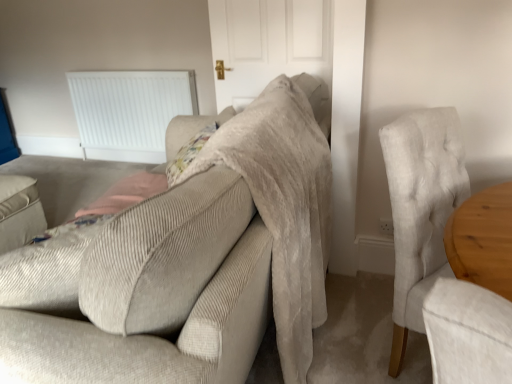
Locate an element on the screen. This screenshot has width=512, height=384. white plastic radiator at upper left is located at coordinates (130, 110).

This screenshot has width=512, height=384. What are the coordinates of `white plastic radiator at upper left` in the screenshot? It's located at (130, 110).

Considering the positions of objects light gray fabric chair at right and white matte door at center in the image provided, who is more to the left, light gray fabric chair at right or white matte door at center?

white matte door at center.

Who is taller, light gray fabric chair at right or white matte door at center?

light gray fabric chair at right.

How different are the orientations of light gray fabric chair at right and white matte door at center in degrees?

The facing directions of light gray fabric chair at right and white matte door at center are 118 degrees apart.

Is light gray fabric chair at right turned away from white matte door at center?

Yes, light gray fabric chair at right's orientation is away from white matte door at center.

Where is `door on the right of beige corduroy couch at center`? This screenshot has width=512, height=384. door on the right of beige corduroy couch at center is located at coordinates (268, 44).

Can you confirm if beige corduroy couch at center is shorter than white matte door at center?

No, beige corduroy couch at center is not shorter than white matte door at center.

Is point (53, 346) farther from viewer compared to point (255, 94)?

No, (53, 346) is closer to viewer.

Does beige corduroy couch at center appear on the left side of white matte door at center?

Correct, you'll find beige corduroy couch at center to the left of white matte door at center.

Is white plastic radiator at upper left closer to camera compared to white matte door at center?

No, white plastic radiator at upper left is further to the viewer.

Can you confirm if white plastic radiator at upper left is thinner than white matte door at center?

No.

Consider the image. Is white plastic radiator at upper left facing away from white matte door at center?

No, white plastic radiator at upper left's orientation is not away from white matte door at center.

Is there a large distance between white plastic radiator at upper left and white matte door at center?

Yes, white plastic radiator at upper left is far from white matte door at center.

Is white matte door at center situated inside light gray fabric chair at right or outside?

white matte door at center is outside light gray fabric chair at right.

Is white matte door at center shorter than light gray fabric chair at right?

Indeed, white matte door at center has a lesser height compared to light gray fabric chair at right.

Is white matte door at center oriented towards light gray fabric chair at right?

No, white matte door at center is not aimed at light gray fabric chair at right.

Are white plastic radiator at upper left and beige corduroy couch at center beside each other?

No, white plastic radiator at upper left is not with beige corduroy couch at center.

Which object is thinner, white plastic radiator at upper left or beige corduroy couch at center?

Thinner between the two is white plastic radiator at upper left.

Looking at the image, does white plastic radiator at upper left seem bigger or smaller compared to beige corduroy couch at center?

In the image, white plastic radiator at upper left appears to be smaller than beige corduroy couch at center.

Is white plastic radiator at upper left not inside beige corduroy couch at center?

Absolutely, white plastic radiator at upper left is external to beige corduroy couch at center.

Is light gray fabric chair at right a part of beige corduroy couch at center?

No, beige corduroy couch at center does not contain light gray fabric chair at right.

Does point (301, 226) come in front of point (402, 310)?

That is True.

Does beige corduroy couch at center have a smaller size compared to light gray fabric chair at right?

Actually, beige corduroy couch at center might be larger than light gray fabric chair at right.

At what (x,y) coordinates should I click in order to perform the action: click on radiator below the light gray fabric chair at right (from a real-world perspective). Please return your answer as a coordinate pair (x, y). Looking at the image, I should click on (130, 110).

Can you tell me how much white plastic radiator at upper left and light gray fabric chair at right differ in facing direction?

The facing directions of white plastic radiator at upper left and light gray fabric chair at right are 59.4 degrees apart.

Is point (164, 129) less distant than point (397, 174)?

No.

In terms of size, does white plastic radiator at upper left appear bigger or smaller than light gray fabric chair at right?

white plastic radiator at upper left is smaller than light gray fabric chair at right.

Find the location of a particular element. door lying behind the light gray fabric chair at right is located at coordinates (268, 44).

Identify the location of door that is on the right side of beige corduroy couch at center. (268, 44).

When comparing their distances from white matte door at center, does light gray fabric chair at right or beige corduroy couch at center seem further?

light gray fabric chair at right.

Considering their positions, is white plastic radiator at upper left positioned closer to light gray fabric chair at right than white matte door at center?

white matte door at center lies closer to light gray fabric chair at right than the other object.

When comparing their distances from white plastic radiator at upper left, does light gray fabric chair at right or beige corduroy couch at center seem closer?

Based on the image, beige corduroy couch at center appears to be nearer to white plastic radiator at upper left.

Looking at the image, which one is located closer to beige corduroy couch at center, white matte door at center or white plastic radiator at upper left?

Among the two, white matte door at center is located nearer to beige corduroy couch at center.

When comparing their distances from white plastic radiator at upper left, does light gray fabric chair at right or white matte door at center seem closer?

white matte door at center is positioned closer to the anchor white plastic radiator at upper left.

From the picture: Estimate the real-world distances between objects in this image. Which object is further from light gray fabric chair at right, white matte door at center or white plastic radiator at upper left?

Among the two, white plastic radiator at upper left is located further to light gray fabric chair at right.

Based on their spatial positions, is white matte door at center or beige corduroy couch at center closer to light gray fabric chair at right?

Based on the image, beige corduroy couch at center appears to be nearer to light gray fabric chair at right.

Considering their positions, is white matte door at center positioned closer to white plastic radiator at upper left than light gray fabric chair at right?

Among the two, white matte door at center is located nearer to white plastic radiator at upper left.

Identify the location of door between beige corduroy couch at center and white plastic radiator at upper left along the z-axis. This screenshot has width=512, height=384. (268, 44).

I want to click on chair positioned between beige corduroy couch at center and white plastic radiator at upper left from near to far, so click(421, 209).

The height and width of the screenshot is (384, 512). What are the coordinates of `door between light gray fabric chair at right and white plastic radiator at upper left in the front-back direction` in the screenshot? It's located at (268, 44).

This screenshot has width=512, height=384. Identify the location of chair between beige corduroy couch at center and white matte door at center from front to back. (421, 209).